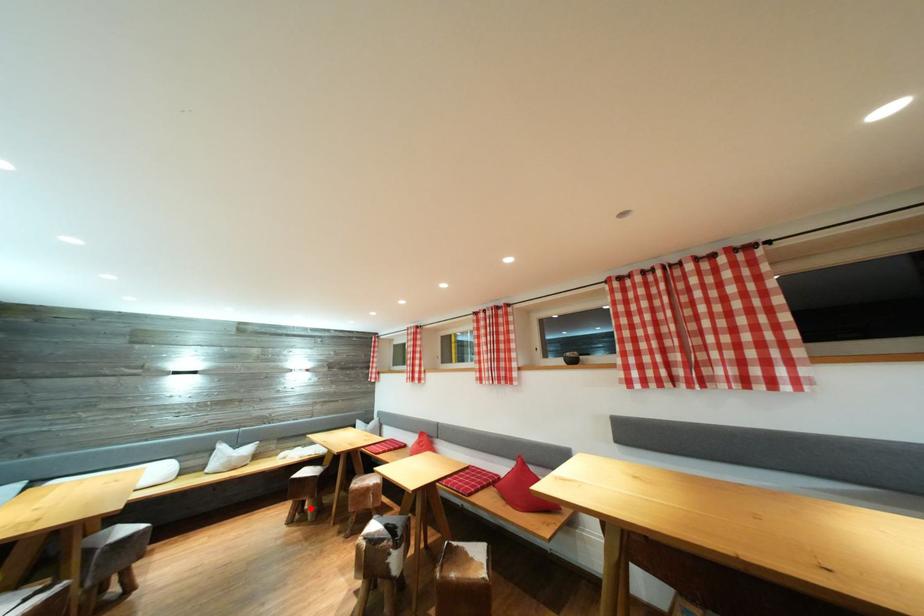
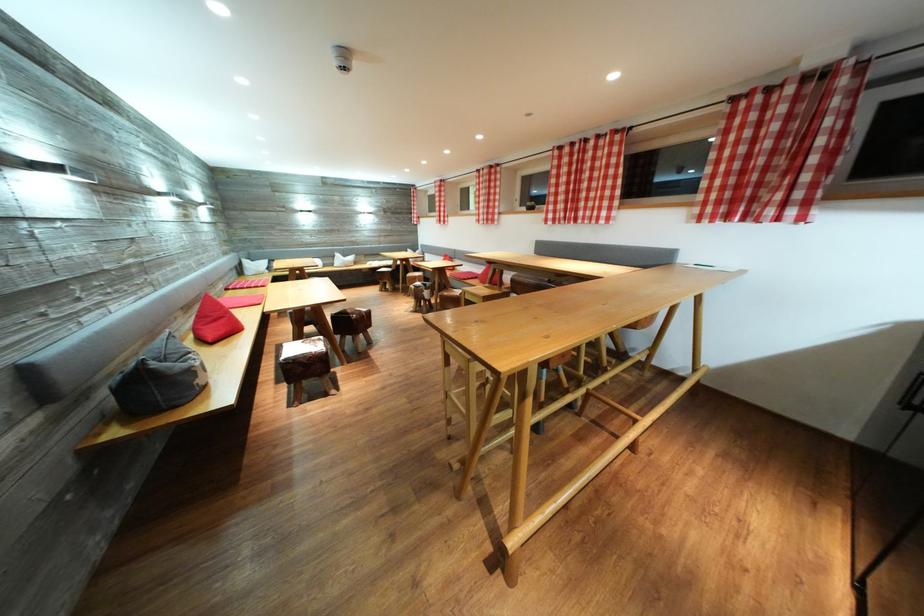
In the second image, find the point that corresponds to the highlighted location in the first image.

(393, 289)